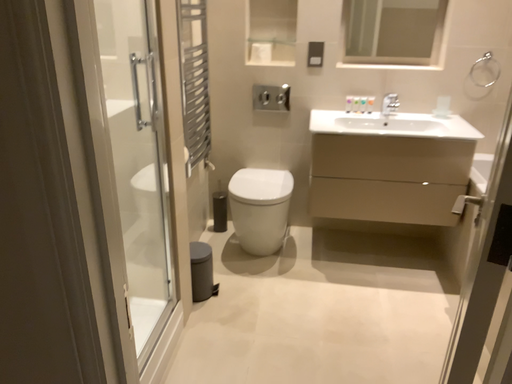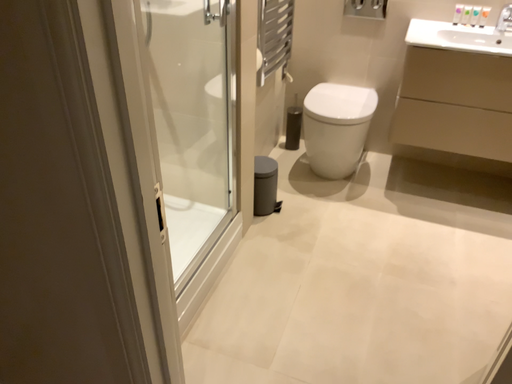
Question: Which way did the camera rotate in the video?

Choices:
 (A) rotated downward
 (B) rotated upward

Answer: (A)